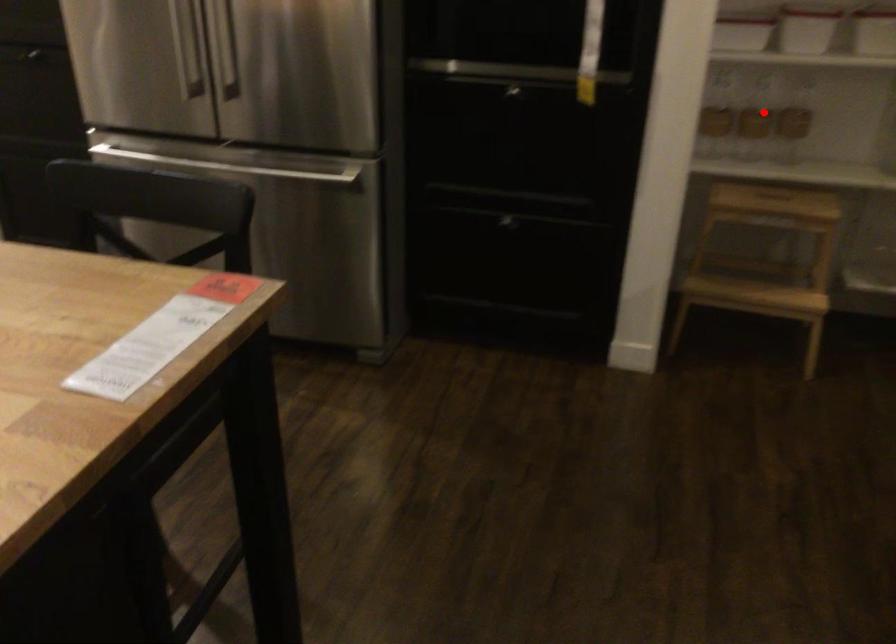
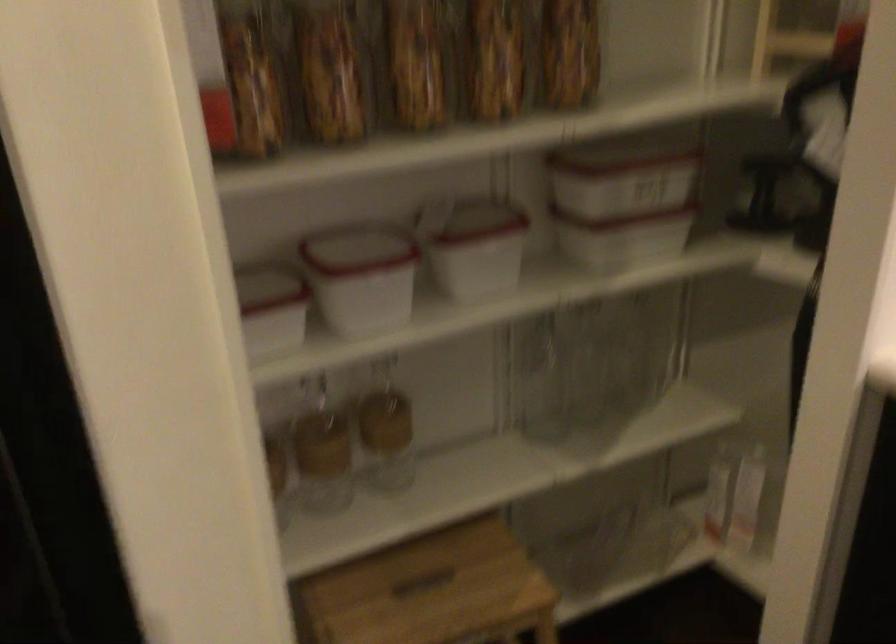
Question: I am providing you with two images of the same scene from different viewpoints. Given a red point in image1, look at the same physical point in image2. Is it:

Choices:
 (A) Closer to the viewpoint
 (B) Farther from the viewpoint

Answer: (A)